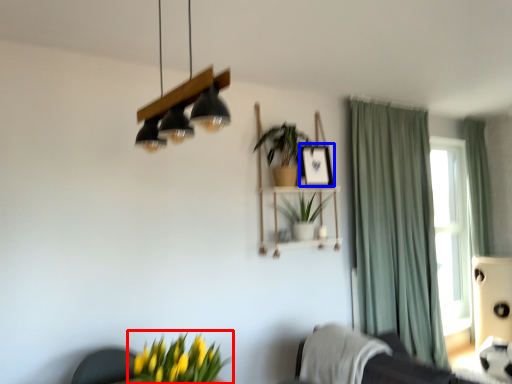
Question: Which of the following is the farthest to the observer, houseplant (highlighted by a red box) or picture frame (highlighted by a blue box)?

Choices:
 (A) houseplant
 (B) picture frame

Answer: (B)